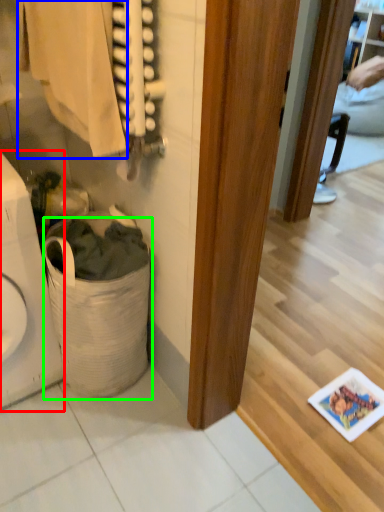
Question: Estimate the real-world distances between objects in this image. Which object is closer to appliance (highlighted by a red box), clothing (highlighted by a blue box) or laundry basket (highlighted by a green box)?

Choices:
 (A) clothing
 (B) laundry basket

Answer: (B)